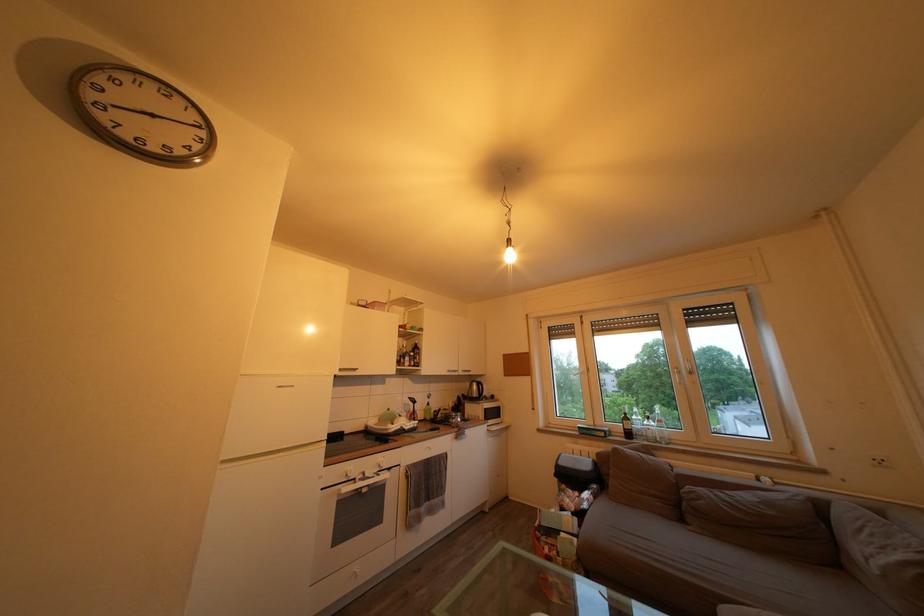
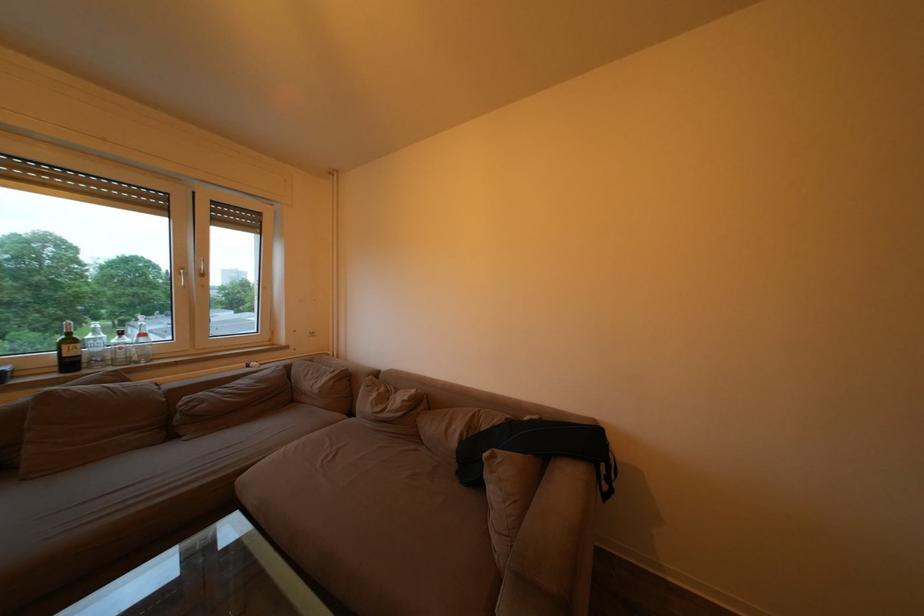
Locate, in the second image, the point that corresponds to point (889, 517) in the first image.

(319, 367)